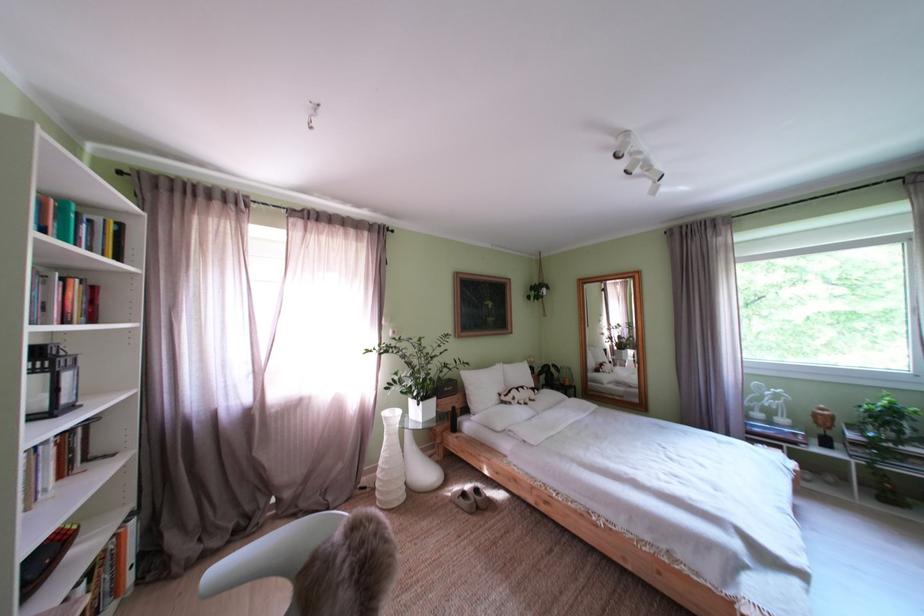
Locate an element on the screen. The width and height of the screenshot is (924, 616). large white vase is located at coordinates (390, 464).